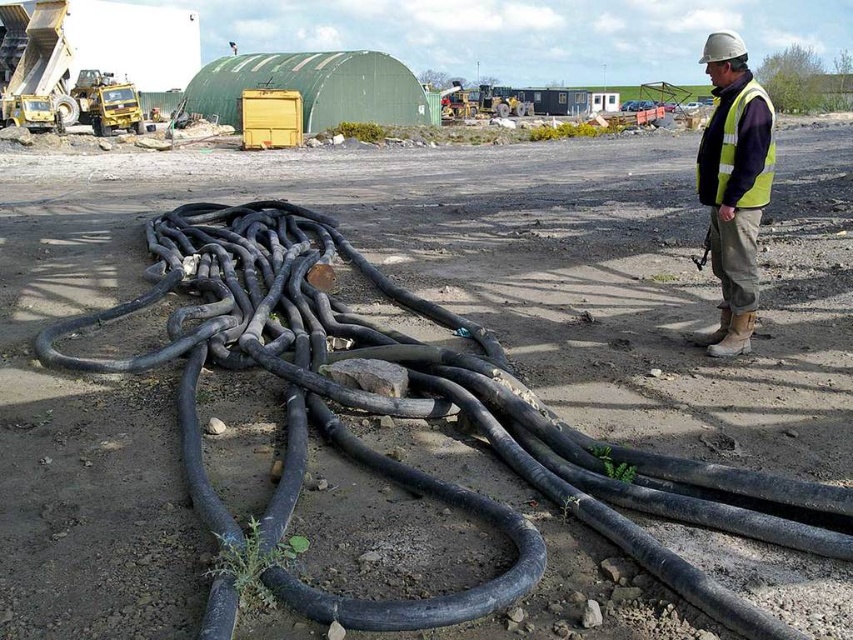
Does black rubber garden hose at lower center appear under high-visibility fabric safety vest at right?

Yes.

Does point (178, 316) come behind point (744, 131)?

Yes.

You are a GUI agent. You are given a task and a screenshot of the screen. Output one action in this format:
    pyautogui.click(x=<x>, y=<y>)
    Task: Click on the black rubber garden hose at lower center
    Image resolution: width=853 pixels, height=640 pixels.
    Given the screenshot: What is the action you would take?
    pyautogui.click(x=425, y=419)

Looking at this image, is yellow reflective vest at right wider than high-visibility fabric safety vest at right?

Yes, yellow reflective vest at right is wider than high-visibility fabric safety vest at right.

The height and width of the screenshot is (640, 853). What do you see at coordinates (733, 186) in the screenshot?
I see `yellow reflective vest at right` at bounding box center [733, 186].

The height and width of the screenshot is (640, 853). What are the coordinates of `yellow reflective vest at right` in the screenshot? It's located at (733, 186).

Does black rubber garden hose at lower center have a lesser width compared to yellow reflective vest at right?

Yes.

Is black rubber garden hose at lower center positioned at the back of yellow reflective vest at right?

That is False.

This screenshot has height=640, width=853. Describe the element at coordinates (425, 419) in the screenshot. I see `black rubber garden hose at lower center` at that location.

Identify the location of black rubber garden hose at lower center. Image resolution: width=853 pixels, height=640 pixels. (425, 419).